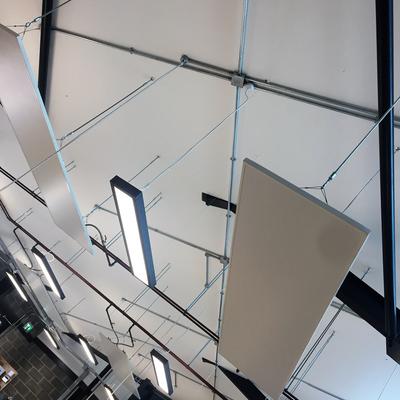
At what (x,y) coordinates should I click in order to perform the action: click on white objects in front of wall. Please return your answer as a coordinate pair (x, y). The height and width of the screenshot is (400, 400). Looking at the image, I should click on (8, 374), (1, 381).